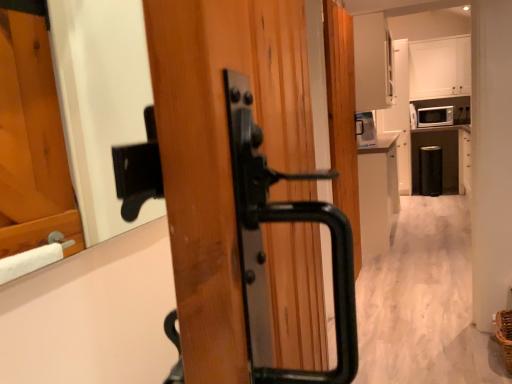
Question: From a real-world perspective, is matte white microwave at upper right on white glossy cabinet at center, the 1th cabinetry when ordered from left to right?

Choices:
 (A) yes
 (B) no

Answer: (A)

Question: Is matte white microwave at upper right next to white glossy cabinet at center, acting as the 1th cabinetry starting from the front, and touching it?

Choices:
 (A) yes
 (B) no

Answer: (B)

Question: Would you say white glossy cabinet at center, acting as the 1th cabinetry starting from the front, is part of matte white microwave at upper right's contents?

Choices:
 (A) no
 (B) yes

Answer: (A)

Question: Does matte white microwave at upper right have a larger size compared to white glossy cabinet at center, the 2th cabinetry viewed from the back?

Choices:
 (A) no
 (B) yes

Answer: (A)

Question: Can you confirm if matte white microwave at upper right is wider than white glossy cabinet at center, acting as the 1th cabinetry starting from the front?

Choices:
 (A) no
 (B) yes

Answer: (B)

Question: From the image's perspective, is white glossy cabinet at center, the second cabinetry from the top, above or below matte white microwave at upper right?

Choices:
 (A) above
 (B) below

Answer: (B)

Question: From a real-world perspective, relative to matte white microwave at upper right, is white glossy cabinet at center, the 1th cabinetry when ordered from left to right, vertically above or below?

Choices:
 (A) below
 (B) above

Answer: (A)

Question: Does point (370, 246) appear closer or farther from the camera than point (442, 110)?

Choices:
 (A) farther
 (B) closer

Answer: (B)

Question: Considering the positions of white glossy cabinet at center, placed as the second cabinetry when sorted from right to left, and matte white microwave at upper right in the image, is white glossy cabinet at center, placed as the second cabinetry when sorted from right to left, wider or thinner than matte white microwave at upper right?

Choices:
 (A) wide
 (B) thin

Answer: (B)

Question: Is matte white microwave at upper right bigger or smaller than white glossy cabinet at center, placed as the second cabinetry when sorted from right to left?

Choices:
 (A) small
 (B) big

Answer: (A)

Question: Is point (446, 110) closer or farther from the camera than point (368, 201)?

Choices:
 (A) farther
 (B) closer

Answer: (A)

Question: Is matte white microwave at upper right taller or shorter than white glossy cabinet at center, placed as the 1th cabinetry when sorted from bottom to top?

Choices:
 (A) short
 (B) tall

Answer: (A)

Question: Is matte white microwave at upper right situated inside white glossy cabinet at center, placed as the second cabinetry when sorted from right to left, or outside?

Choices:
 (A) outside
 (B) inside

Answer: (A)

Question: From the image's perspective, relative to matte white microwave at upper right, is white matte cabinet at upper center, the first cabinetry when ordered from right to left, above or below?

Choices:
 (A) above
 (B) below

Answer: (A)

Question: Based on their sizes in the image, would you say white matte cabinet at upper center, the 1th cabinetry when ordered from back to front, is bigger or smaller than matte white microwave at upper right?

Choices:
 (A) big
 (B) small

Answer: (A)